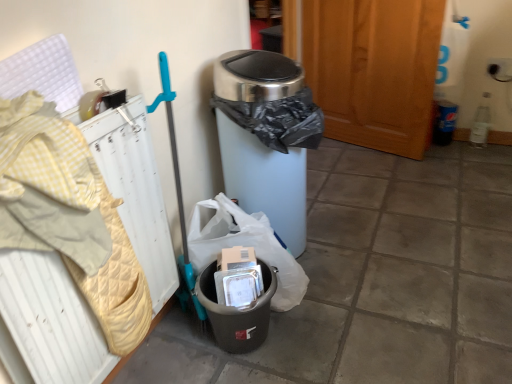
Question: Can you confirm if black plastic trash can at lower center is positioned to the left of yellow quilted radiator at left?

Choices:
 (A) no
 (B) yes

Answer: (A)

Question: Can you confirm if black plastic trash can at lower center is taller than yellow quilted radiator at left?

Choices:
 (A) no
 (B) yes

Answer: (A)

Question: From a real-world perspective, is black plastic trash can at lower center over yellow quilted radiator at left?

Choices:
 (A) no
 (B) yes

Answer: (A)

Question: From the image's perspective, would you say black plastic trash can at lower center is shown under yellow quilted radiator at left?

Choices:
 (A) yes
 (B) no

Answer: (A)

Question: Considering the relative positions of black plastic trash can at lower center and yellow quilted radiator at left in the image provided, is black plastic trash can at lower center in front of yellow quilted radiator at left?

Choices:
 (A) no
 (B) yes

Answer: (A)

Question: Is black plastic trash can at lower center facing away from yellow quilted radiator at left?

Choices:
 (A) no
 (B) yes

Answer: (A)

Question: Is black plastic trash can at lower center at the back of stainless steel trash can at center, which is counted as the 2th waste container, starting from the bottom?

Choices:
 (A) yes
 (B) no

Answer: (B)

Question: From a real-world perspective, does stainless steel trash can at center, the first waste container in the top-to-bottom sequence, stand above black plastic trash can at lower center?

Choices:
 (A) no
 (B) yes

Answer: (B)

Question: Is stainless steel trash can at center, which is counted as the 2th waste container, starting from the bottom, smaller than black plastic trash can at lower center?

Choices:
 (A) yes
 (B) no

Answer: (B)

Question: Considering the relative sizes of stainless steel trash can at center, the first waste container in the top-to-bottom sequence, and black plastic trash can at lower center in the image provided, is stainless steel trash can at center, the first waste container in the top-to-bottom sequence, taller than black plastic trash can at lower center?

Choices:
 (A) yes
 (B) no

Answer: (A)

Question: Considering the relative positions of stainless steel trash can at center, which is counted as the 2th waste container, starting from the bottom, and black plastic trash can at lower center in the image provided, is stainless steel trash can at center, which is counted as the 2th waste container, starting from the bottom, behind black plastic trash can at lower center?

Choices:
 (A) no
 (B) yes

Answer: (A)

Question: Is there a large distance between stainless steel trash can at center, the first waste container in the top-to-bottom sequence, and black plastic trash can at lower center?

Choices:
 (A) no
 (B) yes

Answer: (A)

Question: From a real-world perspective, is stainless steel trash can at center, the first waste container in the top-to-bottom sequence, on wooden screen door at center?

Choices:
 (A) no
 (B) yes

Answer: (A)